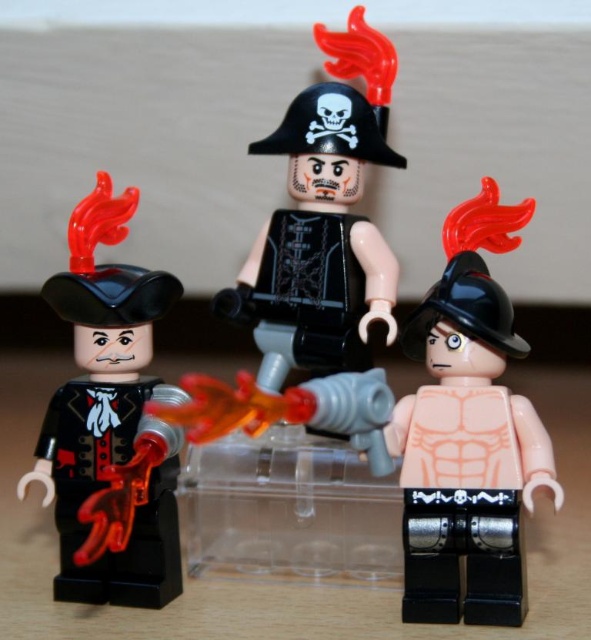
Does point (457, 216) lie in front of point (269, 248)?

Yes, point (457, 216) is in front of point (269, 248).

You are a GUI agent. You are given a task and a screenshot of the screen. Output one action in this format:
    pyautogui.click(x=<x>, y=<y>)
    Task: Click on the matte black torso at center
    The image size is (591, 640).
    Given the screenshot: What is the action you would take?
    pyautogui.click(x=469, y=433)

Can you confirm if matte black pirate hat at left is thinner than matte black pirate hat at center?

Indeed, matte black pirate hat at left has a lesser width compared to matte black pirate hat at center.

Does matte black pirate hat at left have a larger size compared to matte black pirate hat at center?

Actually, matte black pirate hat at left might be smaller than matte black pirate hat at center.

Where is `matte black pirate hat at left`? The width and height of the screenshot is (591, 640). matte black pirate hat at left is located at coordinates (111, 422).

Identify the location of matte black pirate hat at left. Image resolution: width=591 pixels, height=640 pixels. (111, 422).

Is matte black torso at center further to the viewer compared to matte black pirate hat at left?

Yes.

Can you confirm if matte black torso at center is thinner than matte black pirate hat at left?

Yes.

Who is more forward, (485, 224) or (112, 451)?

Point (112, 451) is in front.

Where is `matte black torso at center`? This screenshot has width=591, height=640. matte black torso at center is located at coordinates (469, 433).